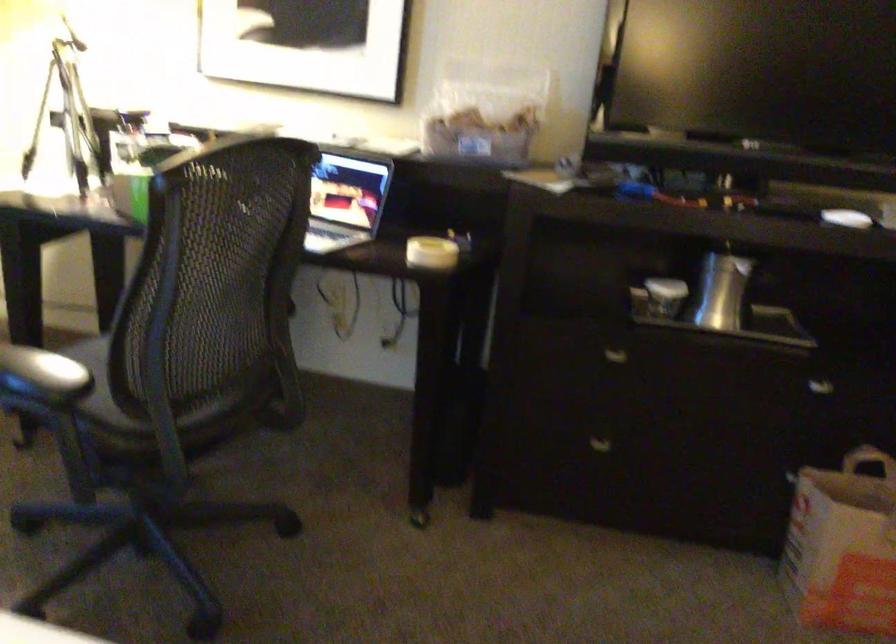
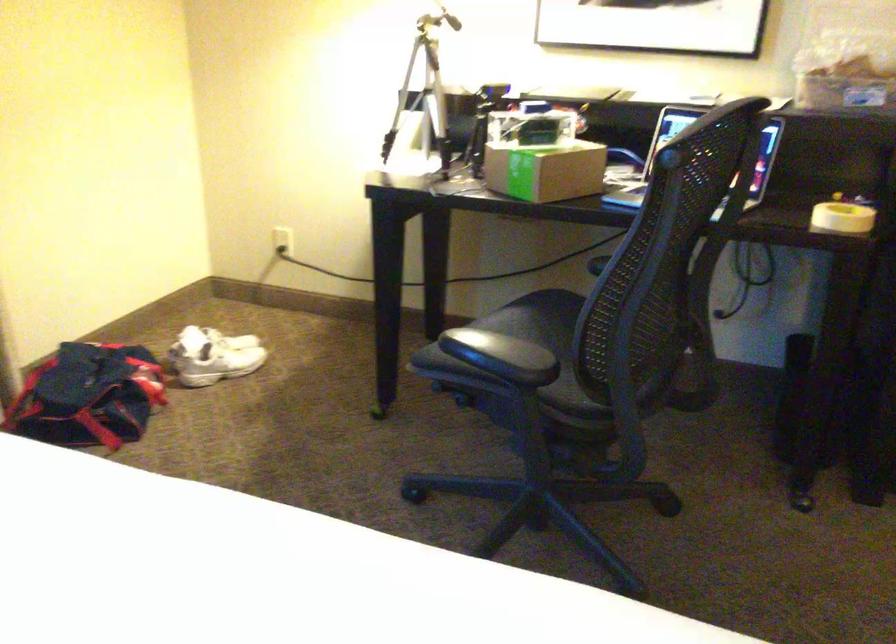
Question: The camera is either moving clockwise (left) or counter-clockwise (right) around the object. The first image is from the beginning of the video and the second image is from the end. Is the camera moving left or right when shooting the video?

Choices:
 (A) Left
 (B) Right

Answer: (B)